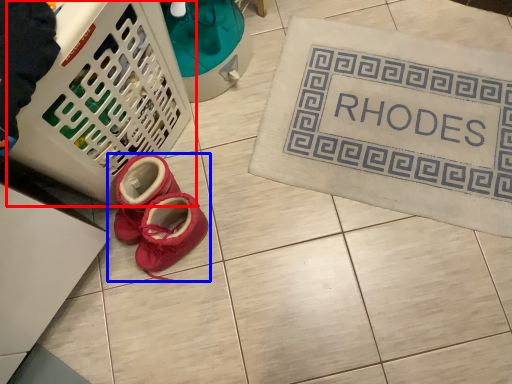
Question: Which object appears farthest to the camera in this image, basket (highlighted by a red box) or footwear (highlighted by a blue box)?

Choices:
 (A) basket
 (B) footwear

Answer: (B)